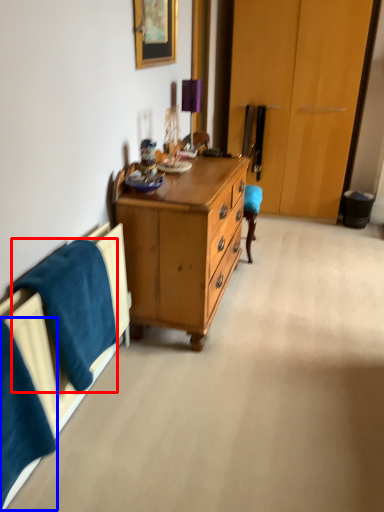
Question: Which object appears farthest to the camera in this image, blanket (highlighted by a red box) or blanket (highlighted by a blue box)?

Choices:
 (A) blanket
 (B) blanket

Answer: (A)